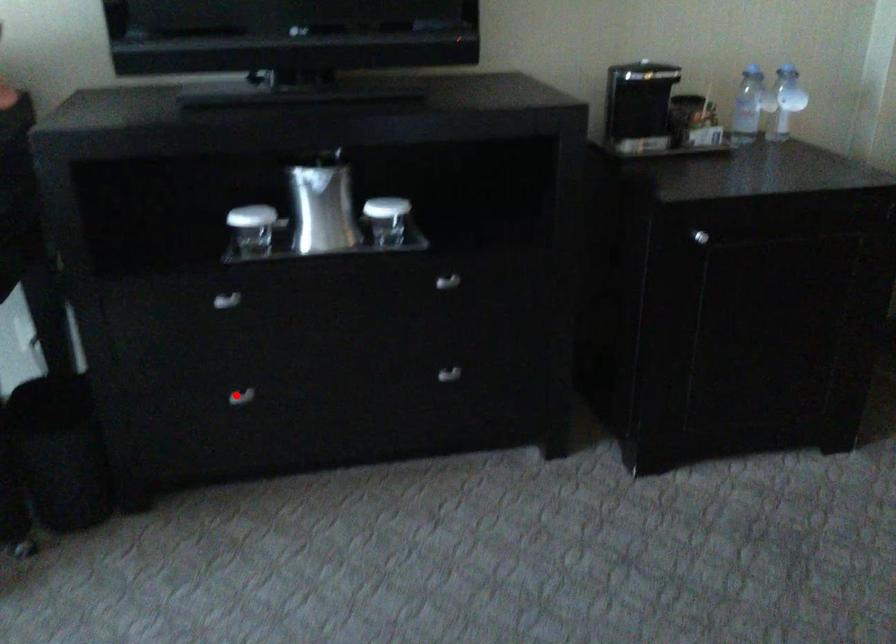
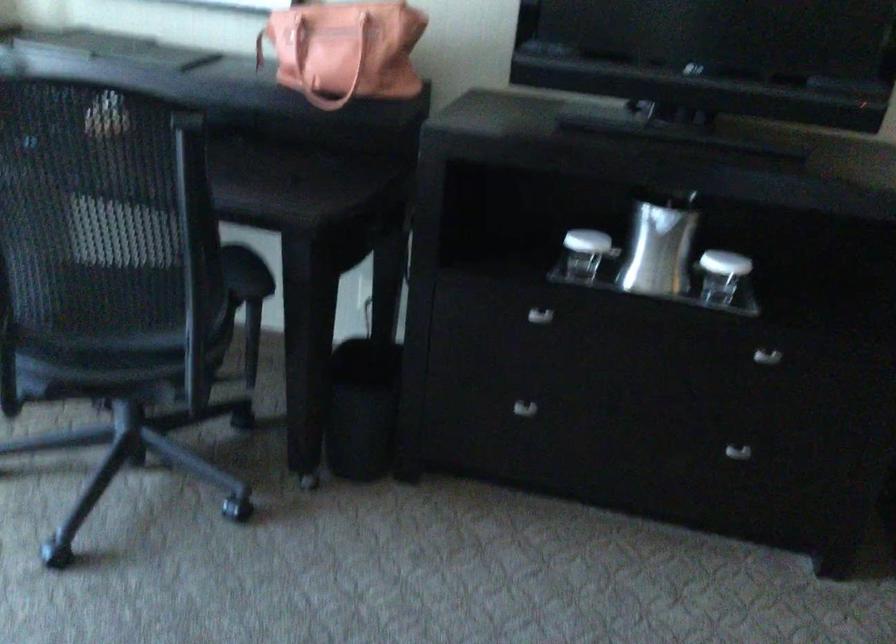
Locate, in the second image, the point that corresponds to the highlighted location in the first image.

(524, 408)